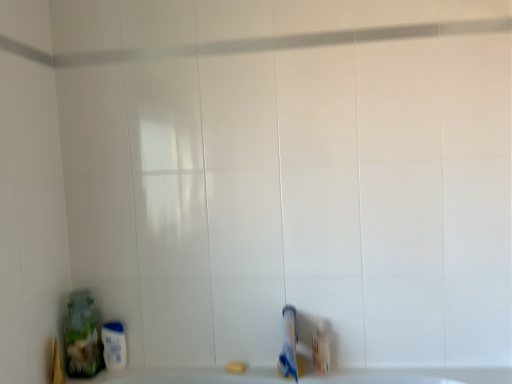
Where is `yellow matte bar of soap at lower center`? yellow matte bar of soap at lower center is located at coordinates (234, 367).

Locate an element on the screen. The width and height of the screenshot is (512, 384). blue matte toothpaste at lower center is located at coordinates (289, 344).

Would you say blue matte toothpaste at lower center contains yellow matte bar of soap at lower center?

No, blue matte toothpaste at lower center does not contain yellow matte bar of soap at lower center.

Is blue matte toothpaste at lower center next to yellow matte bar of soap at lower center and touching it?

blue matte toothpaste at lower center is not next to yellow matte bar of soap at lower center, and they're not touching.

Who is taller, blue matte toothpaste at lower center or yellow matte bar of soap at lower center?

blue matte toothpaste at lower center is taller.

Measure the distance between blue matte toothpaste at lower center and yellow matte bar of soap at lower center.

10.33 inches.

Can you confirm if translucent plastic bottle at lower right is taller than blue matte toothpaste at lower center?

Yes.

Which is nearer, (x=315, y=340) or (x=287, y=371)?

Point (x=315, y=340) is positioned farther from the camera compared to point (x=287, y=371).

Is blue matte toothpaste at lower center inside translucent plastic bottle at lower right?

Definitely not — blue matte toothpaste at lower center is not inside translucent plastic bottle at lower right.

In the scene shown: From the image's perspective, which one is positioned higher, translucent plastic bottle at lower right or blue matte toothpaste at lower center?

blue matte toothpaste at lower center is shown above in the image.

Is blue matte toothpaste at lower center bigger than translucent plastic bottle at lower right?

Correct, blue matte toothpaste at lower center is larger in size than translucent plastic bottle at lower right.

How different are the orientations of blue matte toothpaste at lower center and translucent plastic bottle at lower right in degrees?

0.00466 degrees.

Could you tell me if blue matte toothpaste at lower center is turned towards translucent plastic bottle at lower right?

No, blue matte toothpaste at lower center is not turned towards translucent plastic bottle at lower right.

Considering the positions of objects blue matte toothpaste at lower center and translucent plastic bottle at lower right in the image provided, who is more to the right, blue matte toothpaste at lower center or translucent plastic bottle at lower right?

translucent plastic bottle at lower right is more to the right.

In terms of height, does yellow matte bar of soap at lower center look taller or shorter compared to blue matte toothpaste at lower center?

yellow matte bar of soap at lower center is shorter than blue matte toothpaste at lower center.

Is yellow matte bar of soap at lower center inside the boundaries of blue matte toothpaste at lower center, or outside?

yellow matte bar of soap at lower center lies outside blue matte toothpaste at lower center.

Considering the relative positions of yellow matte bar of soap at lower center and blue matte toothpaste at lower center in the image provided, is yellow matte bar of soap at lower center in front of blue matte toothpaste at lower center?

No, yellow matte bar of soap at lower center is behind blue matte toothpaste at lower center.

From the image's perspective, who appears lower, yellow matte bar of soap at lower center or blue matte toothpaste at lower center?

yellow matte bar of soap at lower center appears lower in the image.

Is translucent plastic bottle at lower right smaller than yellow matte bar of soap at lower center?

Actually, translucent plastic bottle at lower right might be larger than yellow matte bar of soap at lower center.

In the image, is translucent plastic bottle at lower right on the left side or the right side of yellow matte bar of soap at lower center?

translucent plastic bottle at lower right is positioned on yellow matte bar of soap at lower center's right side.

Does point (317, 332) appear closer or farther from the camera than point (240, 371)?

Point (317, 332) appears to be closer to the viewer than point (240, 371).

Who is shorter, yellow matte bar of soap at lower center or translucent plastic bottle at lower right?

Standing shorter between the two is yellow matte bar of soap at lower center.

What's the angular difference between yellow matte bar of soap at lower center and translucent plastic bottle at lower right's facing directions?

0.00878 degrees separate the facing orientations of yellow matte bar of soap at lower center and translucent plastic bottle at lower right.

Consider the image. Is the depth of yellow matte bar of soap at lower center greater than that of translucent plastic bottle at lower right?

Yes, it is.

Image resolution: width=512 pixels, height=384 pixels. Identify the location of soap beneath the translucent plastic bottle at lower right (from a real-world perspective). (234, 367).

Identify the location of toothpaste in front of the yellow matte bar of soap at lower center. (289, 344).

This screenshot has width=512, height=384. I want to click on toiletry on the right of the blue matte toothpaste at lower center, so click(321, 350).

Based on their spatial positions, is blue matte toothpaste at lower center or yellow matte bar of soap at lower center further from translucent plastic bottle at lower right?

yellow matte bar of soap at lower center lies further to translucent plastic bottle at lower right than the other object.

Looking at the image, which one is located closer to yellow matte bar of soap at lower center, blue matte toothpaste at lower center or translucent plastic bottle at lower right?

blue matte toothpaste at lower center is positioned closer to the anchor yellow matte bar of soap at lower center.

Estimate the real-world distances between objects in this image. Which object is further from yellow matte bar of soap at lower center, translucent plastic bottle at lower right or blue matte toothpaste at lower center?

translucent plastic bottle at lower right.

Looking at the image, which one is located closer to translucent plastic bottle at lower right, yellow matte bar of soap at lower center or blue matte toothpaste at lower center?

The object closer to translucent plastic bottle at lower right is blue matte toothpaste at lower center.

Looking at the image, which one is located closer to blue matte toothpaste at lower center, yellow matte bar of soap at lower center or translucent plastic bottle at lower right?

Among the two, translucent plastic bottle at lower right is located nearer to blue matte toothpaste at lower center.

When comparing their distances from blue matte toothpaste at lower center, does translucent plastic bottle at lower right or yellow matte bar of soap at lower center seem closer?

Based on the image, translucent plastic bottle at lower right appears to be nearer to blue matte toothpaste at lower center.

I want to click on toothpaste between yellow matte bar of soap at lower center and translucent plastic bottle at lower right from left to right, so click(x=289, y=344).